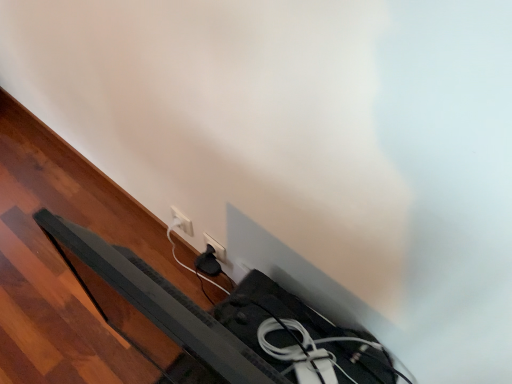
You are a GUI agent. You are given a task and a screenshot of the screen. Output one action in this format:
    pyautogui.click(x=<x>, y=<y>)
    Task: Click on the white plastic power plug at lower center, arranged as the second power plugs and sockets when viewed from the left
    
    Given the screenshot: What is the action you would take?
    pyautogui.click(x=216, y=247)

Measure the distance between white plastic power plug at lower center, arranged as the second power plugs and sockets when viewed from the left, and camera.

white plastic power plug at lower center, arranged as the second power plugs and sockets when viewed from the left, and camera are 4.03 feet apart from each other.

Locate an element on the screen. This screenshot has width=512, height=384. white plastic socket at lower center, positioned as the second power plugs and sockets in right-to-left order is located at coordinates (182, 221).

Considering the relative positions of white plastic power plug at lower center, arranged as the second power plugs and sockets when viewed from the left, and white plastic socket at lower center, which is counted as the first power plugs and sockets, starting from the left, in the image provided, is white plastic power plug at lower center, arranged as the second power plugs and sockets when viewed from the left, to the left of white plastic socket at lower center, which is counted as the first power plugs and sockets, starting from the left, from the viewer's perspective?

In fact, white plastic power plug at lower center, arranged as the second power plugs and sockets when viewed from the left, is to the right of white plastic socket at lower center, which is counted as the first power plugs and sockets, starting from the left.

Does white plastic power plug at lower center, the first power plugs and sockets positioned from the right, have a greater width compared to white plastic socket at lower center, which is counted as the first power plugs and sockets, starting from the left?

Indeed, white plastic power plug at lower center, the first power plugs and sockets positioned from the right, has a greater width compared to white plastic socket at lower center, which is counted as the first power plugs and sockets, starting from the left.

Does white plastic power plug at lower center, the first power plugs and sockets positioned from the right, have a greater height compared to white plastic socket at lower center, positioned as the second power plugs and sockets in right-to-left order?

No.

Does point (216, 250) lie behind point (183, 219)?

No.

Choose the correct answer: Is white plastic socket at lower center, positioned as the second power plugs and sockets in right-to-left order, inside black plastic bed frame at lower left or outside it?

white plastic socket at lower center, positioned as the second power plugs and sockets in right-to-left order, exists outside the volume of black plastic bed frame at lower left.

Does white plastic socket at lower center, which is counted as the first power plugs and sockets, starting from the left, turn towards black plastic bed frame at lower left?

No, white plastic socket at lower center, which is counted as the first power plugs and sockets, starting from the left, is not aimed at black plastic bed frame at lower left.

Considering the relative positions of white plastic socket at lower center, which is counted as the first power plugs and sockets, starting from the left, and black plastic bed frame at lower left in the image provided, is white plastic socket at lower center, which is counted as the first power plugs and sockets, starting from the left, to the right of black plastic bed frame at lower left from the viewer's perspective?

No, white plastic socket at lower center, which is counted as the first power plugs and sockets, starting from the left, is not to the right of black plastic bed frame at lower left.

Would you say black plastic bed frame at lower left contains white plastic power plug at lower center, the first power plugs and sockets positioned from the right?

Definitely not — white plastic power plug at lower center, the first power plugs and sockets positioned from the right, is not inside black plastic bed frame at lower left.

Visually, is black plastic bed frame at lower left positioned to the left or to the right of white plastic power plug at lower center, the first power plugs and sockets positioned from the right?

black plastic bed frame at lower left is to the left of white plastic power plug at lower center, the first power plugs and sockets positioned from the right.

Considering the relative sizes of black plastic bed frame at lower left and white plastic power plug at lower center, the first power plugs and sockets positioned from the right, in the image provided, is black plastic bed frame at lower left bigger than white plastic power plug at lower center, the first power plugs and sockets positioned from the right,?

Correct, black plastic bed frame at lower left is larger in size than white plastic power plug at lower center, the first power plugs and sockets positioned from the right.

Which object is closer to the camera, black plastic bed frame at lower left or white plastic power plug at lower center, the first power plugs and sockets positioned from the right?

black plastic bed frame at lower left is in front.

At what (x,y) coordinates should I click in order to perform the action: click on power plugs and sockets that appears on the right of black plastic bed frame at lower left. Please return your answer as a coordinate pair (x, y). This screenshot has height=384, width=512. Looking at the image, I should click on (216, 247).

Is point (220, 247) positioned in front of point (188, 319)?

No, (220, 247) is behind (188, 319).

Is white plastic power plug at lower center, arranged as the second power plugs and sockets when viewed from the left, closer to camera compared to black plastic bed frame at lower left?

No, the depth of white plastic power plug at lower center, arranged as the second power plugs and sockets when viewed from the left, is greater than that of black plastic bed frame at lower left.

Considering the sizes of objects white plastic power plug at lower center, the first power plugs and sockets positioned from the right, and black plastic bed frame at lower left in the image provided, who is shorter, white plastic power plug at lower center, the first power plugs and sockets positioned from the right, or black plastic bed frame at lower left?

Standing shorter between the two is white plastic power plug at lower center, the first power plugs and sockets positioned from the right.

In the scene shown: Is black plastic bed frame at lower left placed right next to white plastic socket at lower center, which is counted as the first power plugs and sockets, starting from the left?

No, black plastic bed frame at lower left is not in contact with white plastic socket at lower center, which is counted as the first power plugs and sockets, starting from the left.

From a real-world perspective, who is located lower, black plastic bed frame at lower left or white plastic socket at lower center, which is counted as the first power plugs and sockets, starting from the left?

white plastic socket at lower center, which is counted as the first power plugs and sockets, starting from the left, is physically lower.

Can you confirm if black plastic bed frame at lower left is positioned to the left of white plastic socket at lower center, which is counted as the first power plugs and sockets, starting from the left?

In fact, black plastic bed frame at lower left is to the right of white plastic socket at lower center, which is counted as the first power plugs and sockets, starting from the left.

The height and width of the screenshot is (384, 512). Find the location of `bed frame on the right side of white plastic socket at lower center, positioned as the second power plugs and sockets in right-to-left order`. bed frame on the right side of white plastic socket at lower center, positioned as the second power plugs and sockets in right-to-left order is located at coordinates (153, 308).

Consider the image. Measure the distance from white plastic socket at lower center, which is counted as the first power plugs and sockets, starting from the left, to white plastic power plug at lower center, arranged as the second power plugs and sockets when viewed from the left.

white plastic socket at lower center, which is counted as the first power plugs and sockets, starting from the left, is 4.18 inches away from white plastic power plug at lower center, arranged as the second power plugs and sockets when viewed from the left.

Which is behind, white plastic socket at lower center, positioned as the second power plugs and sockets in right-to-left order, or white plastic power plug at lower center, arranged as the second power plugs and sockets when viewed from the left?

white plastic socket at lower center, positioned as the second power plugs and sockets in right-to-left order, is further from the camera.

Looking at the image, does white plastic socket at lower center, positioned as the second power plugs and sockets in right-to-left order, seem bigger or smaller compared to white plastic power plug at lower center, arranged as the second power plugs and sockets when viewed from the left?

In the image, white plastic socket at lower center, positioned as the second power plugs and sockets in right-to-left order, appears to be smaller than white plastic power plug at lower center, arranged as the second power plugs and sockets when viewed from the left.

From a real-world perspective, is white plastic socket at lower center, positioned as the second power plugs and sockets in right-to-left order, over white plastic power plug at lower center, the first power plugs and sockets positioned from the right?

No, from a real-world perspective, white plastic socket at lower center, positioned as the second power plugs and sockets in right-to-left order, is not over white plastic power plug at lower center, the first power plugs and sockets positioned from the right

Where is `power plugs and sockets below the white plastic socket at lower center, which is counted as the first power plugs and sockets, starting from the left (from the image's perspective)`? This screenshot has width=512, height=384. power plugs and sockets below the white plastic socket at lower center, which is counted as the first power plugs and sockets, starting from the left (from the image's perspective) is located at coordinates (216, 247).

There is a white plastic socket at lower center, positioned as the second power plugs and sockets in right-to-left order. Where is `bed frame above it (from a real-world perspective)`? bed frame above it (from a real-world perspective) is located at coordinates (153, 308).

From the picture: When comparing their distances from white plastic power plug at lower center, arranged as the second power plugs and sockets when viewed from the left, does white plastic socket at lower center, which is counted as the first power plugs and sockets, starting from the left, or black plastic bed frame at lower left seem further?

black plastic bed frame at lower left is further to white plastic power plug at lower center, arranged as the second power plugs and sockets when viewed from the left.

From the image, which object appears to be nearer to white plastic socket at lower center, which is counted as the first power plugs and sockets, starting from the left, black plastic bed frame at lower left or white plastic power plug at lower center, arranged as the second power plugs and sockets when viewed from the left?

white plastic power plug at lower center, arranged as the second power plugs and sockets when viewed from the left, lies closer to white plastic socket at lower center, which is counted as the first power plugs and sockets, starting from the left, than the other object.

Considering their positions, is white plastic socket at lower center, positioned as the second power plugs and sockets in right-to-left order, positioned closer to black plastic bed frame at lower left than white plastic power plug at lower center, arranged as the second power plugs and sockets when viewed from the left?

white plastic power plug at lower center, arranged as the second power plugs and sockets when viewed from the left, lies closer to black plastic bed frame at lower left than the other object.

Based on their spatial positions, is white plastic power plug at lower center, arranged as the second power plugs and sockets when viewed from the left, or black plastic bed frame at lower left further from white plastic socket at lower center, which is counted as the first power plugs and sockets, starting from the left?

Among the two, black plastic bed frame at lower left is located further to white plastic socket at lower center, which is counted as the first power plugs and sockets, starting from the left.

Looking at the image, which one is located further to black plastic bed frame at lower left, white plastic power plug at lower center, arranged as the second power plugs and sockets when viewed from the left, or white plastic socket at lower center, positioned as the second power plugs and sockets in right-to-left order?

white plastic socket at lower center, positioned as the second power plugs and sockets in right-to-left order, is positioned further to the anchor black plastic bed frame at lower left.

Looking at the image, which one is located closer to white plastic power plug at lower center, the first power plugs and sockets positioned from the right, black plastic bed frame at lower left or white plastic socket at lower center, which is counted as the first power plugs and sockets, starting from the left?

white plastic socket at lower center, which is counted as the first power plugs and sockets, starting from the left, lies closer to white plastic power plug at lower center, the first power plugs and sockets positioned from the right, than the other object.

The image size is (512, 384). Find the location of `power plugs and sockets located between black plastic bed frame at lower left and white plastic socket at lower center, positioned as the second power plugs and sockets in right-to-left order, in the depth direction`. power plugs and sockets located between black plastic bed frame at lower left and white plastic socket at lower center, positioned as the second power plugs and sockets in right-to-left order, in the depth direction is located at coordinates (216, 247).